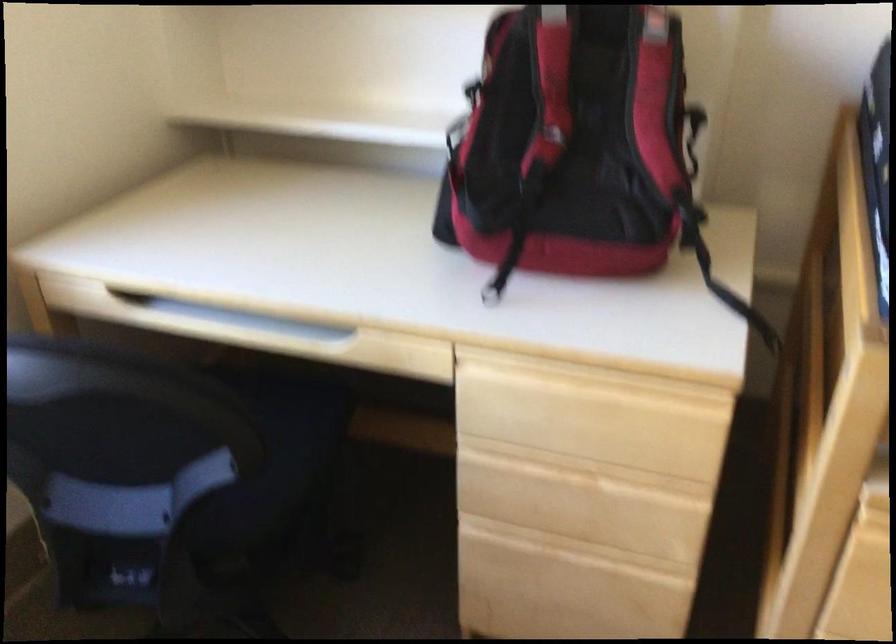
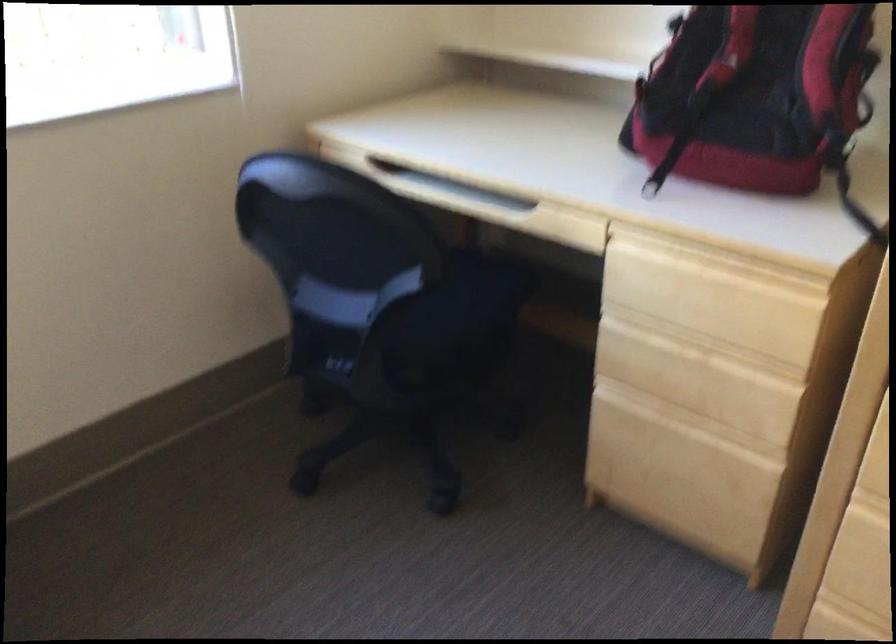
Question: The camera is either moving clockwise (left) or counter-clockwise (right) around the object. The first image is from the beginning of the video and the second image is from the end. Is the camera moving left or right when shooting the video?

Choices:
 (A) Left
 (B) Right

Answer: (B)